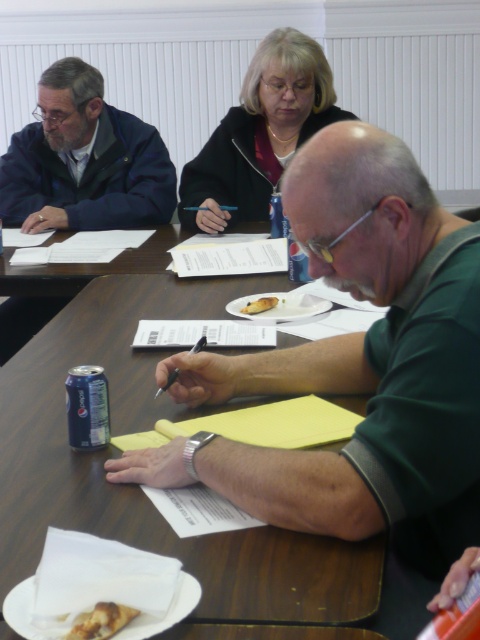
Question: Is green matte shirt at center further to the viewer compared to yellow matte pizza slice at center?

Choices:
 (A) no
 (B) yes

Answer: (A)

Question: Does green matte shirt at center appear on the left side of blue metallic can at table center?

Choices:
 (A) yes
 (B) no

Answer: (B)

Question: Among these points, which one is farthest from the camera?

Choices:
 (A) (265, 140)
 (B) (97, 410)
 (C) (344, 147)

Answer: (A)

Question: Which point is farther to the camera?

Choices:
 (A) brown crumbly pastry at lower left
 (B) green matte shirt at center
 (C) yellow matte pizza slice at center

Answer: (C)

Question: Which point is closer to the camera?

Choices:
 (A) (45, 467)
 (B) (85, 634)
 (C) (313, 211)

Answer: (B)

Question: Does brown crumbly pastry at lower left have a greater width compared to yellow matte pizza slice at center?

Choices:
 (A) no
 (B) yes

Answer: (A)